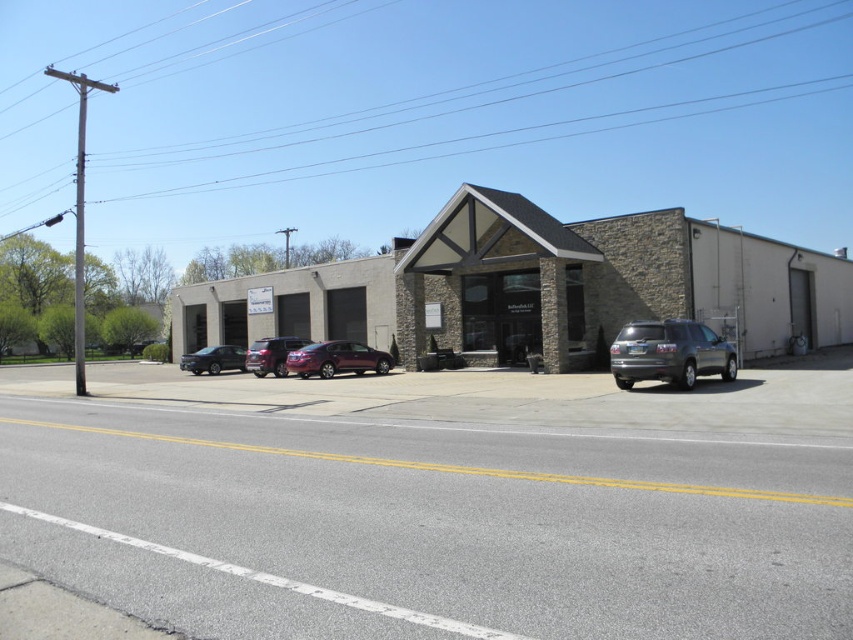
Is point (270, 364) positioned before point (219, 349)?

Yes, point (270, 364) is closer to viewer.

The image size is (853, 640). Identify the location of metallic purple sedan at center. (271, 355).

Can you confirm if satin silver suv at right is shorter than satin burgundy sedan at center?

Correct, satin silver suv at right is not as tall as satin burgundy sedan at center.

Can you confirm if satin silver suv at right is positioned to the left of satin burgundy sedan at center?

In fact, satin silver suv at right is to the right of satin burgundy sedan at center.

Is point (711, 352) positioned after point (318, 364)?

No, it is in front of (318, 364).

You are a GUI agent. You are given a task and a screenshot of the screen. Output one action in this format:
    pyautogui.click(x=<x>, y=<y>)
    Task: Click on the satin silver suv at right
    The height and width of the screenshot is (640, 853).
    Given the screenshot: What is the action you would take?
    pyautogui.click(x=669, y=353)

Does satin burgundy sedan at center have a greater width compared to metallic purple sedan at center?

No.

Between point (296, 349) and point (260, 349), which one is positioned behind?

The point (296, 349) is more distant.

This screenshot has width=853, height=640. I want to click on satin burgundy sedan at center, so click(335, 358).